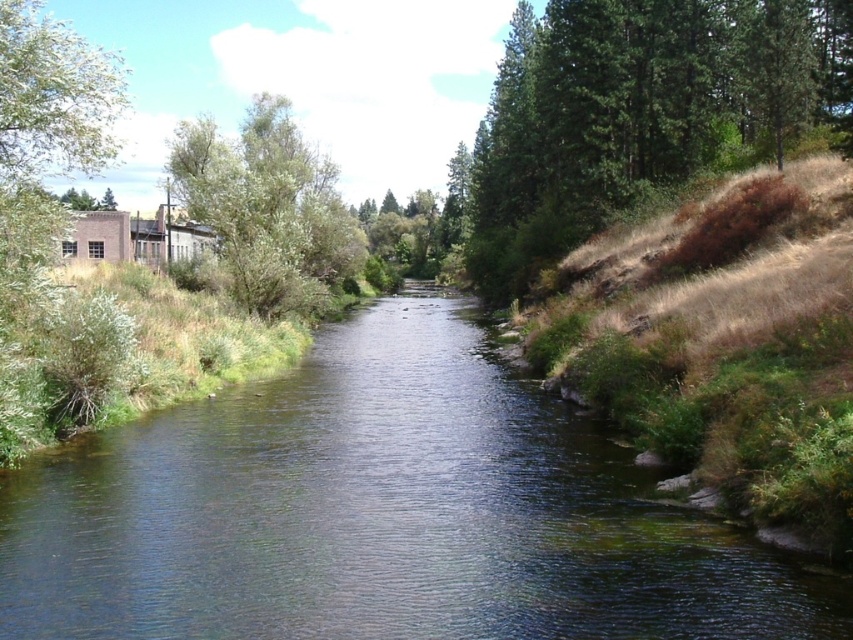
Is clear water at center positioned in front of green leafy tree at left?

Yes, it is.

Who is higher up, clear water at center or green leafy tree at left?

green leafy tree at left

Is point (669, 589) farther from camera compared to point (51, 77)?

That is False.

At what (x,y) coordinates should I click in order to perform the action: click on clear water at center. Please return your answer as a coordinate pair (x, y). This screenshot has height=640, width=853. Looking at the image, I should click on coord(381,513).

Does clear water at center have a greater width compared to green leafy tree at upper left?

No, clear water at center is not wider than green leafy tree at upper left.

Is clear water at center above green leafy tree at upper left?

No, clear water at center is not above green leafy tree at upper left.

Who is more forward, (793, 637) or (224, 189)?

Point (793, 637) is more forward.

I want to click on clear water at center, so click(381, 513).

Who is positioned more to the left, green textured tree at right or green leafy tree at left?

green leafy tree at left

Is green textured tree at right shorter than green leafy tree at left?

Correct, green textured tree at right is not as tall as green leafy tree at left.

Does point (815, 60) come closer to viewer compared to point (67, 77)?

That is False.

The image size is (853, 640). In order to click on green textured tree at right in this screenshot , I will do `click(637, 113)`.